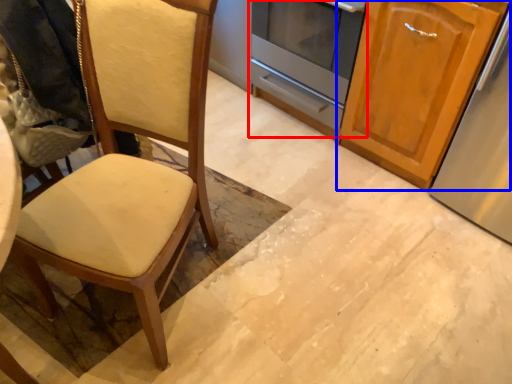
Question: Which point is further to the camera, oven (highlighted by a red box) or cabinetry (highlighted by a blue box)?

Choices:
 (A) oven
 (B) cabinetry

Answer: (A)